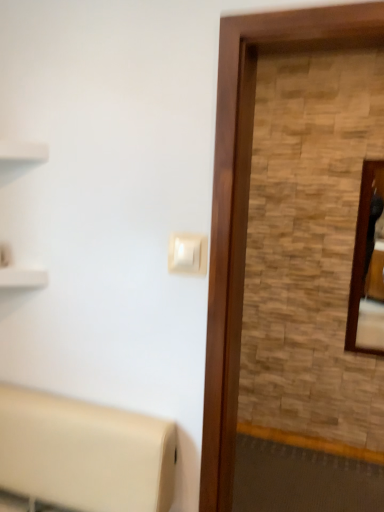
Question: Is point (205, 273) positioned closer to the camera than point (228, 253)?

Choices:
 (A) farther
 (B) closer

Answer: (A)

Question: Is white plastic light switch at center in front of or behind wooden screen door at right in the image?

Choices:
 (A) front
 (B) behind

Answer: (B)

Question: Based on their relative distances, which object is farther from the white plastic light switch at center?

Choices:
 (A) wooden screen door at right
 (B) wooden frame mirror at right

Answer: (B)

Question: Considering the real-world distances, which object is closest to the wooden screen door at right?

Choices:
 (A) wooden frame mirror at right
 (B) white plastic light switch at center

Answer: (B)